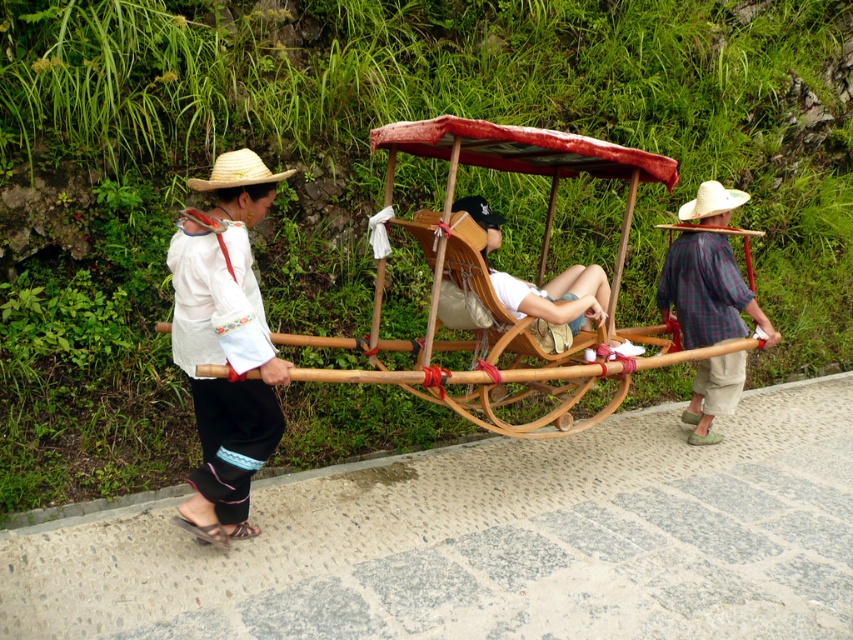
Question: Which is nearer to the white embroidered blouse at left?

Choices:
 (A) white straw hat at center
 (B) bamboo cart at center

Answer: (B)

Question: Is the position of bamboo cart at center more distant than that of white straw hat at center?

Choices:
 (A) yes
 (B) no

Answer: (B)

Question: Estimate the real-world distances between objects in this image. Which object is closer to the plaid fabric cart at right?

Choices:
 (A) bamboo cart at center
 (B) strawtexturehat at left
 (C) white embroidered blouse at left

Answer: (A)

Question: Is white embroidered blouse at left positioned behind strawtexturehat at left?

Choices:
 (A) no
 (B) yes

Answer: (A)

Question: Which object appears farthest from the camera in this image?

Choices:
 (A) bamboo cart at center
 (B) plaid fabric cart at right
 (C) strawtexturehat at left
 (D) white straw hat at center

Answer: (D)

Question: Does white embroidered blouse at left appear on the left side of plaid fabric cart at right?

Choices:
 (A) no
 (B) yes

Answer: (B)